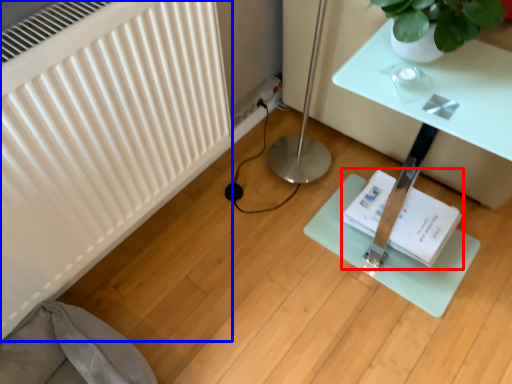
Question: Which of the following is the closest to the observer, book (highlighted by a red box) or radiator (highlighted by a blue box)?

Choices:
 (A) book
 (B) radiator

Answer: (B)